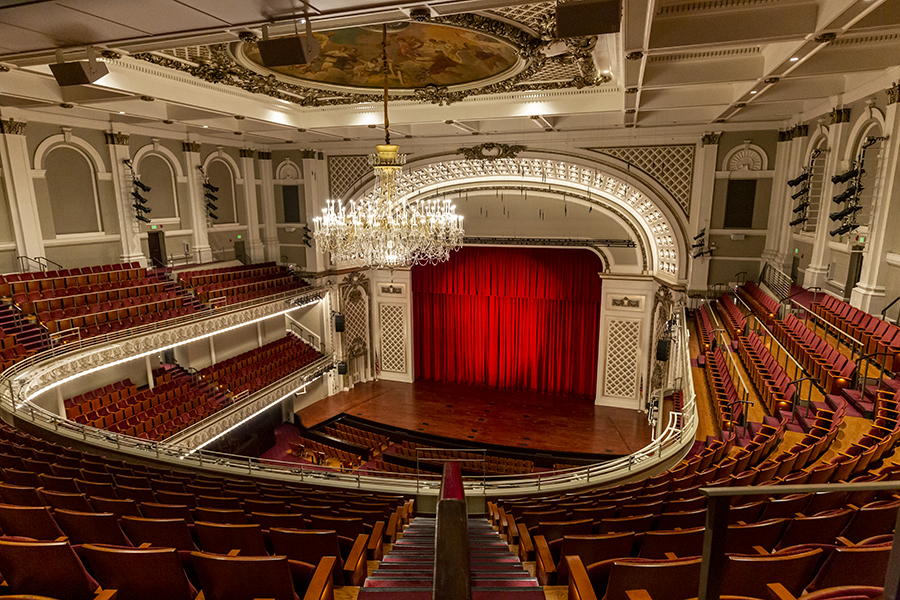
This screenshot has width=900, height=600. In order to click on green light in this screenshot , I will do `click(862, 240)`.